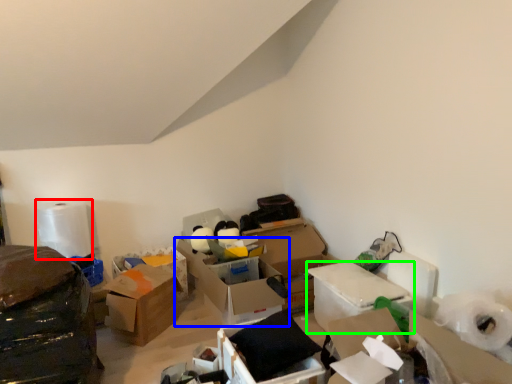
Question: Based on their relative distances, which object is nearer to toilet paper (highlighted by a red box)? Choose from box (highlighted by a blue box) and box (highlighted by a green box).

Choices:
 (A) box
 (B) box

Answer: (A)